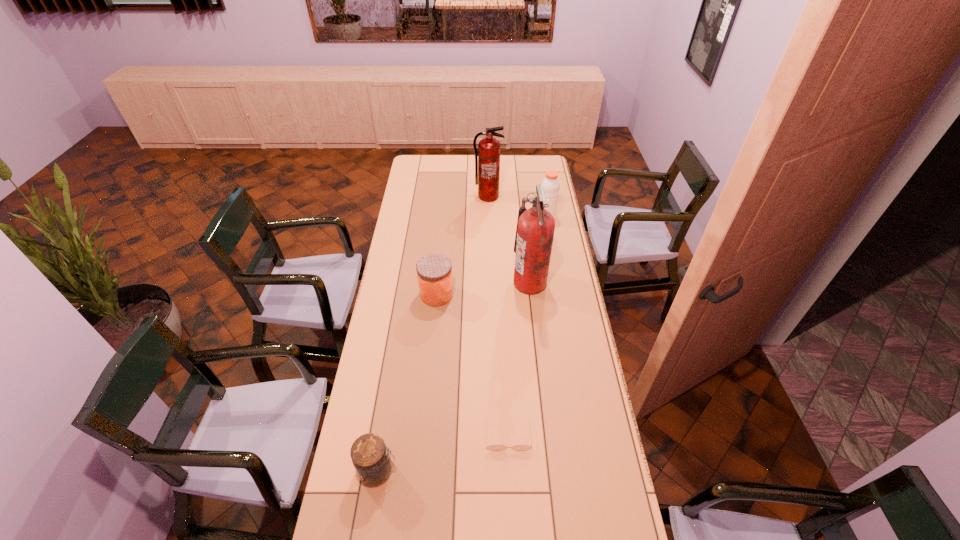
Where is `the tallest object`? This screenshot has height=540, width=960. the tallest object is located at coordinates (535, 229).

Where is `the nearer fire extinguisher`? The width and height of the screenshot is (960, 540). the nearer fire extinguisher is located at coordinates (535, 229).

Identify the location of the second tallest object. (487, 162).

This screenshot has height=540, width=960. Find the location of `the farther fire extinguisher`. the farther fire extinguisher is located at coordinates (487, 162).

Locate an element on the screen. the rightmost object is located at coordinates click(x=551, y=185).

In order to click on shaker in this screenshot , I will do `click(551, 185)`.

Find the location of a particular element. This screenshot has width=960, height=540. the fifth object from right to left is located at coordinates (434, 271).

At what (x,y) coordinates should I click in order to perform the action: click on the farther jar. Please return your answer as a coordinate pair (x, y). Image resolution: width=960 pixels, height=540 pixels. Looking at the image, I should click on (434, 271).

Identify the location of the left jar. (372, 462).

Identify the location of the second shortest object. (372, 462).